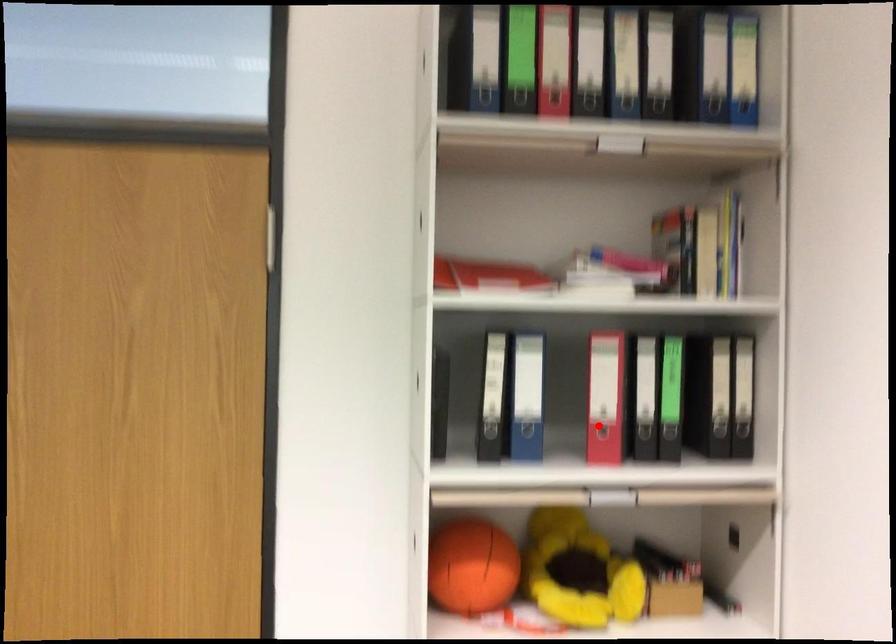
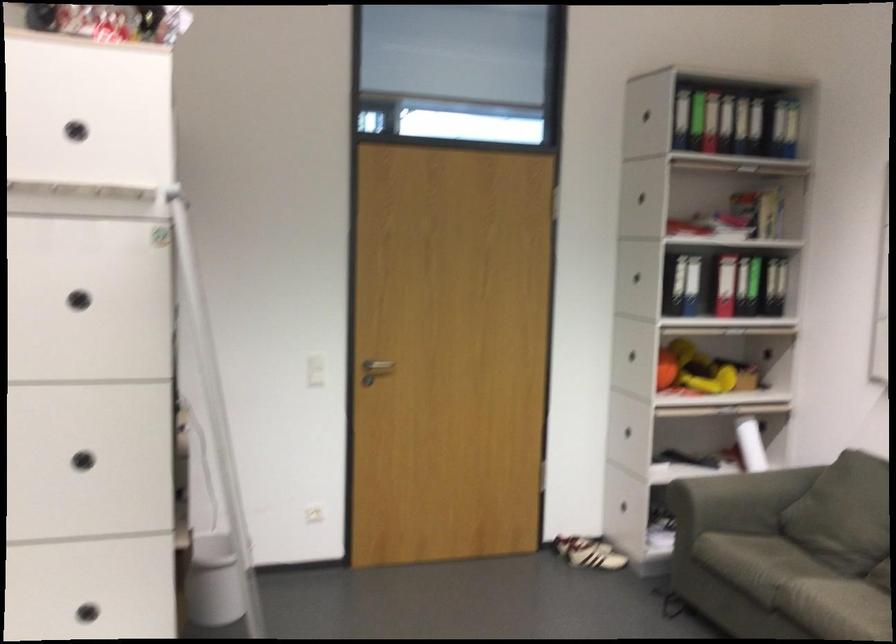
Question: I am providing you with two images of the same scene from different viewpoints. Given a red point in image1, look at the same physical point in image2. Is it:

Choices:
 (A) Closer to the viewpoint
 (B) Farther from the viewpoint

Answer: (B)